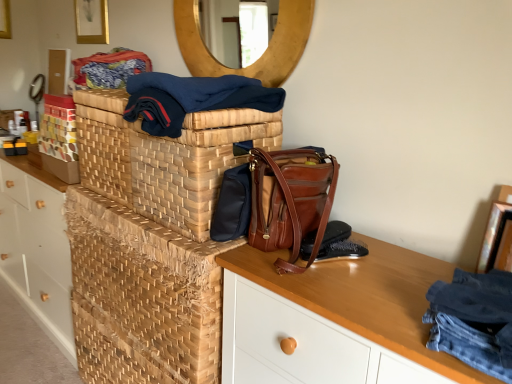
Locate an element on the screen. free area in between brown leather shoe at center, the second shoe in the top-to-bottom sequence, and denim jeans at right, which ranks as the first clothing in front-to-back order is located at coordinates (378, 294).